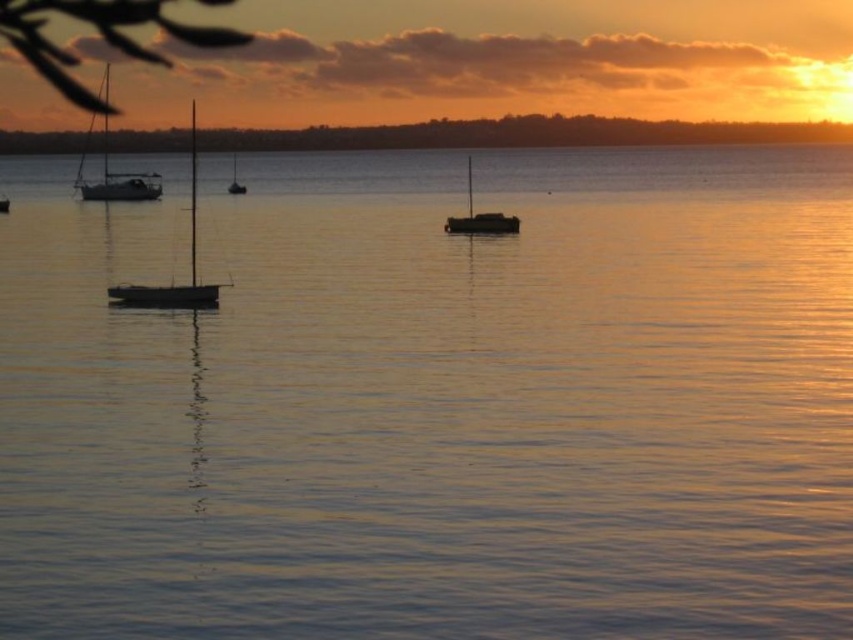
Which is in front, point (157, 188) or point (469, 173)?

Point (469, 173) is more forward.

Is point (155, 193) positioned behind point (465, 228)?

Yes, it is.

Where is `white matte sailboat at left`? This screenshot has width=853, height=640. white matte sailboat at left is located at coordinates (114, 177).

Where is `dark brown wooden boat at center`? dark brown wooden boat at center is located at coordinates (480, 216).

Which is more to the right, orange matte horizon at upper center or shiny silver sailboat at center?

From the viewer's perspective, orange matte horizon at upper center appears more on the right side.

Which of these two, orange matte horizon at upper center or shiny silver sailboat at center, stands taller?

shiny silver sailboat at center

You are a GUI agent. You are given a task and a screenshot of the screen. Output one action in this format:
    pyautogui.click(x=<x>, y=<y>)
    Task: Click on the orange matte horizon at upper center
    The height and width of the screenshot is (640, 853).
    Given the screenshot: What is the action you would take?
    pyautogui.click(x=521, y=132)